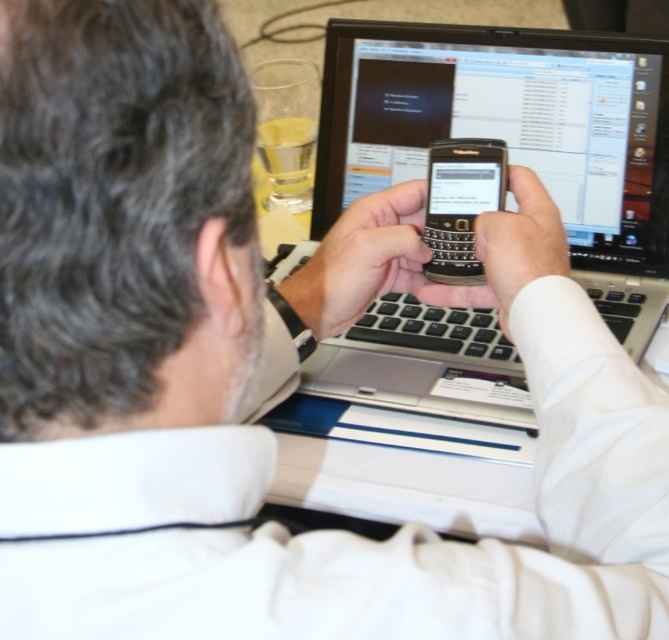
You are a photographer taking a picture of the silver metallic laptop at center and the black plastic smartphone at center. Which object should you focus on first if you want to capture both in focus, given that your camera can only focus on one plane at a time?

The silver metallic laptop at center is above the black plastic smartphone at center, so you should focus on the silver metallic laptop at center first to ensure both are in focus since it is closer to the camera plane.

You are trying to locate two points on the image. The first point is at coordinate point(520, 376) and the second is at point(462, 244). From the perspective of someone sitting at the desk, which point is closer to them?

Point(462, 244) is closer to the person sitting at the desk because it is in front of point(520, 376).

You have a small desk with limited space. You need to place both the silver metallic laptop at center and the black plastic smartphone at center on it. Since the desk can only accommodate one of them, which one should you choose to place on the desk first to maximize space efficiency?

The black plastic smartphone at center has a smaller width than the silver metallic laptop at center, so you should place the silver metallic laptop at center first to utilize the available space more effectively.